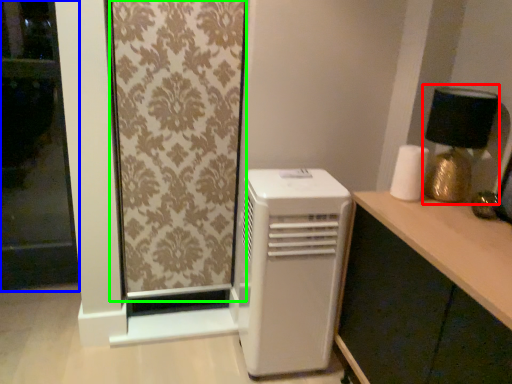
Question: Considering the real-world distances, which object is farthest from table lamp (highlighted by a red box)? screen door (highlighted by a blue box) or curtain (highlighted by a green box)?

Choices:
 (A) screen door
 (B) curtain

Answer: (A)